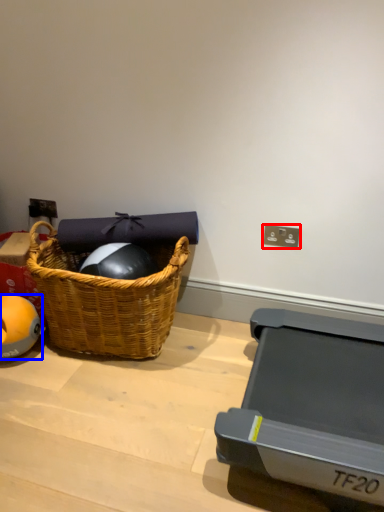
Question: Which object is closer to the camera taking this photo, electric outlet (highlighted by a red box) or ball (highlighted by a blue box)?

Choices:
 (A) electric outlet
 (B) ball

Answer: (B)